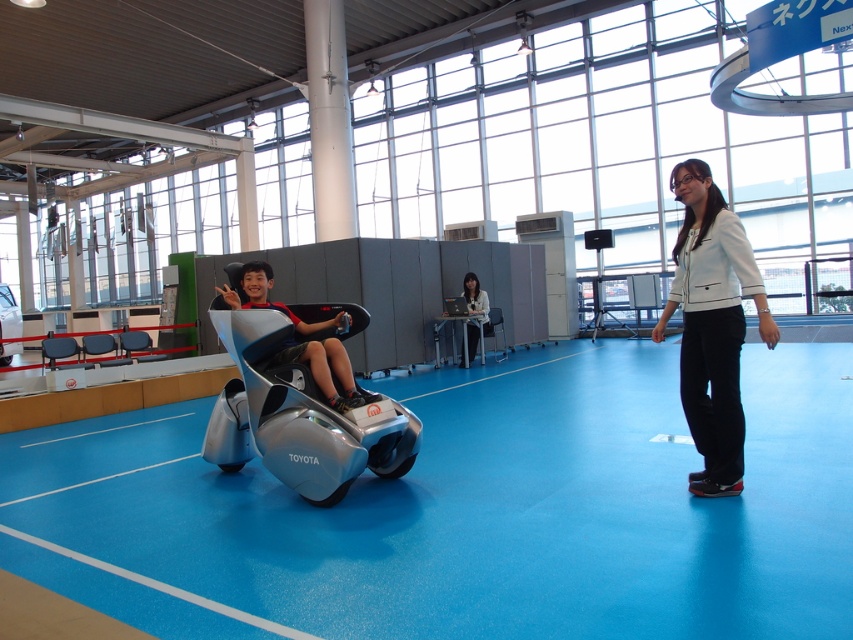
Question: Among these objects, which one is farthest from the camera?

Choices:
 (A) white fabric jacket at center
 (B) silver metallic car at center

Answer: (A)

Question: Does silver metallic mobility scooter at center appear on the right side of silver metallic car at center?

Choices:
 (A) yes
 (B) no

Answer: (A)

Question: Estimate the real-world distances between objects in this image. Which object is farther from the silver metallic mobility scooter at center?

Choices:
 (A) white fabric jacket at center
 (B) silver metallic car at center

Answer: (A)

Question: Which point appears farthest from the camera in this image?

Choices:
 (A) (738, 385)
 (B) (317, 330)
 (C) (242, 380)

Answer: (B)

Question: Can you confirm if silver metallic mobility scooter at center is positioned to the right of white matte jacket at center?

Choices:
 (A) no
 (B) yes

Answer: (A)

Question: Does white matte jacket at center appear on the right side of white fabric jacket at center?

Choices:
 (A) yes
 (B) no

Answer: (A)